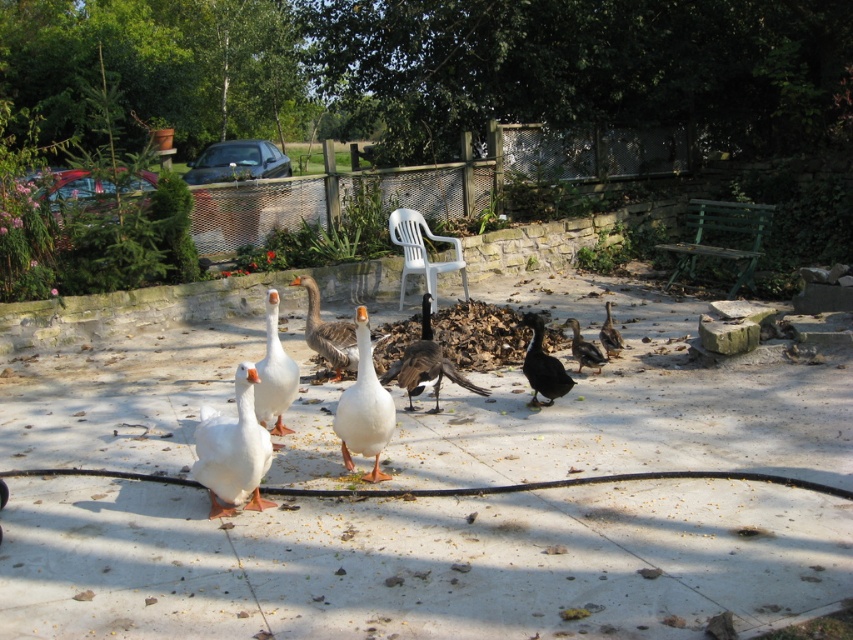
Does point (206, 426) come farther from viewer compared to point (706, 216)?

No, (206, 426) is in front of (706, 216).

Does white matte duck at lower left have a greater width compared to green wooden bench at center right?

Incorrect, white matte duck at lower left's width does not surpass green wooden bench at center right's.

Identify the location of white matte duck at lower left. (231, 451).

Who is taller, white glossy goose at center or white plastic chair at center?

Standing taller between the two is white plastic chair at center.

The height and width of the screenshot is (640, 853). Describe the element at coordinates (274, 372) in the screenshot. I see `white glossy goose at center` at that location.

Where is `white glossy goose at center`? Image resolution: width=853 pixels, height=640 pixels. white glossy goose at center is located at coordinates (274, 372).

Which of these two, green wooden bench at center right or dark brown glossy duck at center, stands taller?

Standing taller between the two is green wooden bench at center right.

Can you confirm if green wooden bench at center right is thinner than dark brown glossy duck at center?

In fact, green wooden bench at center right might be wider than dark brown glossy duck at center.

What do you see at coordinates (722, 228) in the screenshot?
I see `green wooden bench at center right` at bounding box center [722, 228].

You are a GUI agent. You are given a task and a screenshot of the screen. Output one action in this format:
    pyautogui.click(x=<x>, y=<y>)
    Task: Click on the green wooden bench at center right
    The image size is (853, 640).
    Given the screenshot: What is the action you would take?
    pyautogui.click(x=722, y=228)